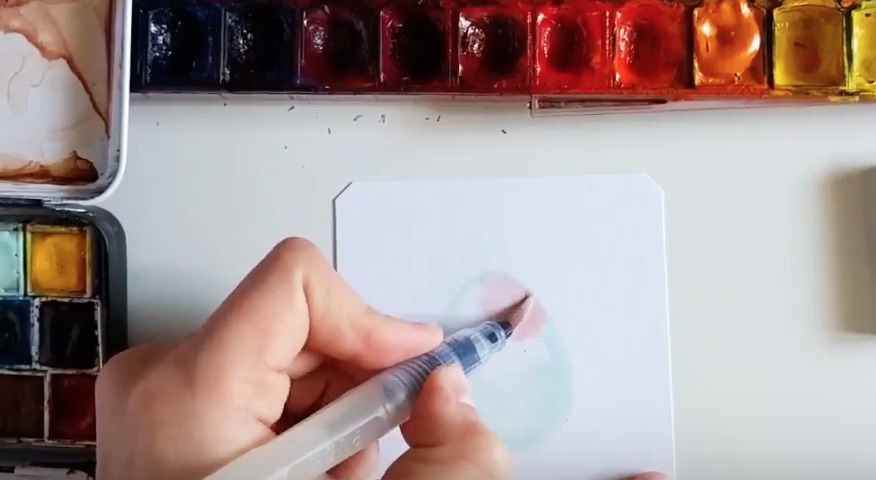
Where is `maroon paint`? This screenshot has width=876, height=480. maroon paint is located at coordinates (418, 66).